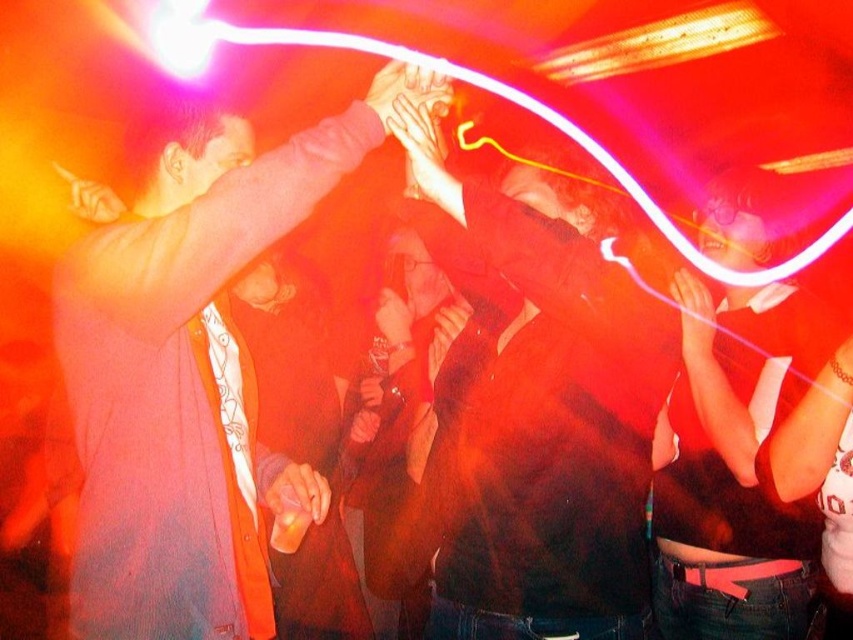
Which is in front, point (136, 625) or point (596, 336)?

Point (136, 625)

Is matte pink sweater at upper left shorter than dark brown leather jacket at center?

Yes, matte pink sweater at upper left is shorter than dark brown leather jacket at center.

Who is more distant from viewer, (82, 289) or (500, 442)?

Point (500, 442)

I want to click on matte pink sweater at upper left, so click(x=193, y=378).